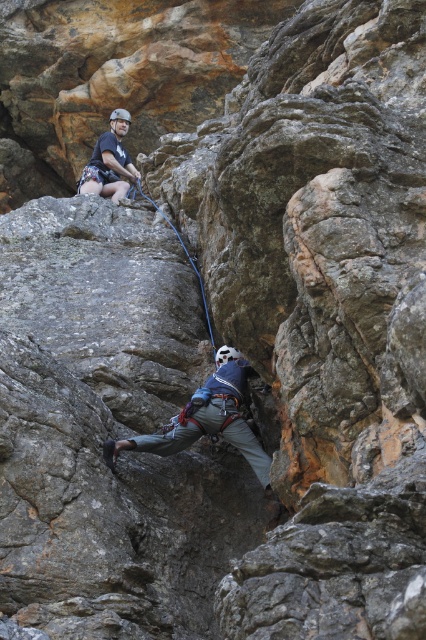
Question: Is gray fabric helmet at center thinner than black rubber rope at center?

Choices:
 (A) yes
 (B) no

Answer: (A)

Question: Which object is positioned farthest from the matte black helmet at upper center?

Choices:
 (A) gray fabric helmet at center
 (B) black rubber rope at center

Answer: (A)

Question: Which of the following is the farthest from the observer?

Choices:
 (A) matte black helmet at upper center
 (B) black rubber rope at center

Answer: (A)

Question: Which object is closer to the camera taking this photo?

Choices:
 (A) black rubber rope at center
 (B) matte black helmet at upper center

Answer: (A)

Question: Can you confirm if gray fabric helmet at center is wider than black rubber rope at center?

Choices:
 (A) yes
 (B) no

Answer: (B)

Question: Does gray fabric helmet at center appear on the right side of black rubber rope at center?

Choices:
 (A) yes
 (B) no

Answer: (A)